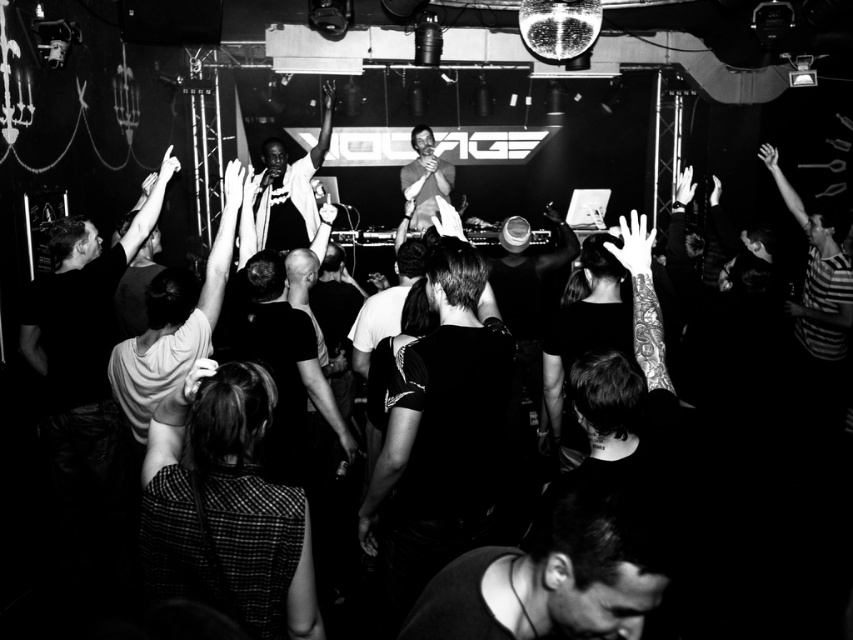
Question: Which of the following is the farthest from the observer?

Choices:
 (A) (606, 488)
 (B) (149, 384)
 (C) (311, 189)
 (D) (413, 227)

Answer: (D)

Question: Can you confirm if dark fabric shirt at lower center is thinner than white matte shirt at center?

Choices:
 (A) yes
 (B) no

Answer: (A)

Question: Is white matte shirt at center positioned behind smooth skin at center?

Choices:
 (A) yes
 (B) no

Answer: (B)

Question: Is smooth black shirt at center smaller than white matte shirt at center?

Choices:
 (A) yes
 (B) no

Answer: (A)

Question: Among these points, which one is nearest to the camera?

Choices:
 (A) (415, 163)
 (B) (572, 573)
 (C) (281, 228)

Answer: (B)

Question: Which point appears farthest from the camera in this image?

Choices:
 (A) (578, 534)
 (B) (276, 161)

Answer: (B)